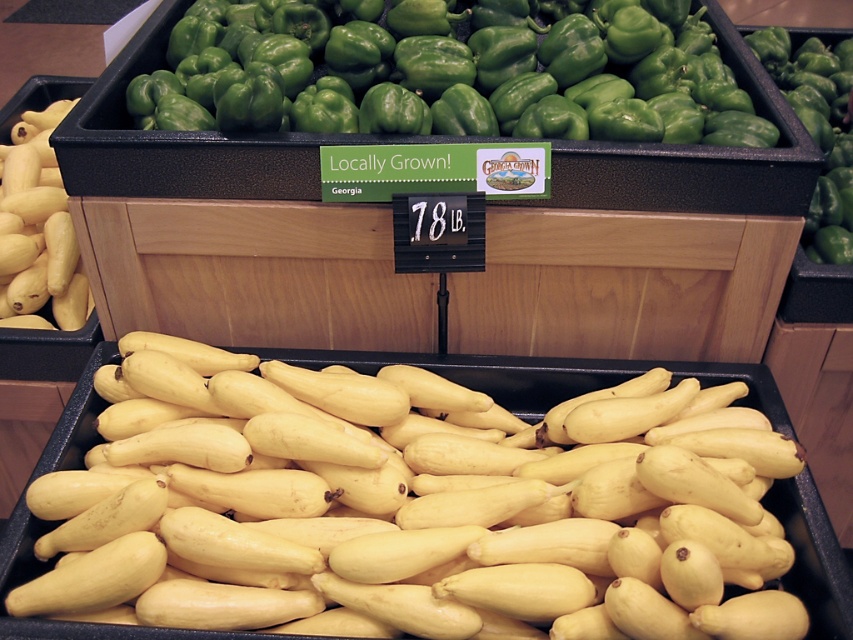
Between yellow matte squash at center and green glossy bell pepper at upper center, which one has less height?

yellow matte squash at center

Who is positioned more to the right, yellow matte squash at center or green glossy bell pepper at upper center?

green glossy bell pepper at upper center

Locate an element on the screen. yellow matte squash at center is located at coordinates (421, 536).

Between point (524, 481) and point (20, 124), which one is positioned in front?

Positioned in front is point (524, 481).

Locate an element on the screen. yellow matte squash at center is located at coordinates (421, 536).

Does green glossy bell pepper at upper center appear on the right side of yellow matte squash at left?

Yes, green glossy bell pepper at upper center is to the right of yellow matte squash at left.

Does point (608, 33) lie behind point (22, 289)?

No, (608, 33) is in front of (22, 289).

This screenshot has width=853, height=640. In order to click on green glossy bell pepper at upper center in this screenshot , I will do `click(457, 92)`.